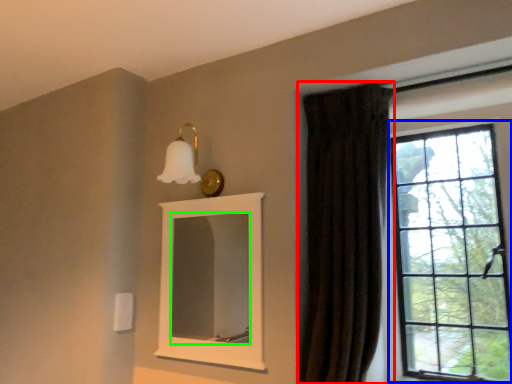
Question: Which object is positioned closest to curtain (highlighted by a red box)? Select from window (highlighted by a blue box) and mirror (highlighted by a green box).

Choices:
 (A) window
 (B) mirror

Answer: (A)